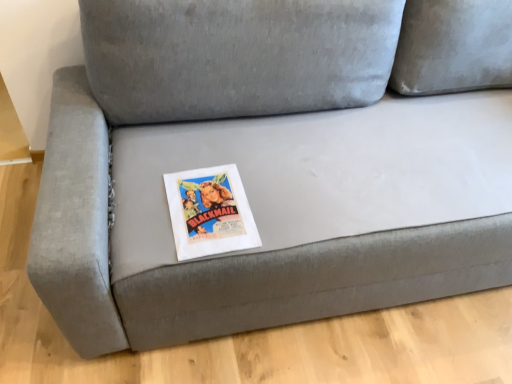
Find the location of a particular element. The height and width of the screenshot is (384, 512). white paper book at center is located at coordinates (210, 212).

What is the approximate width of white paper book at center?

It is 11.91 inches.

What is the approximate height of white paper book at center?

It is 0.62 inches.

The width and height of the screenshot is (512, 384). What do you see at coordinates (210, 212) in the screenshot?
I see `white paper book at center` at bounding box center [210, 212].

The height and width of the screenshot is (384, 512). I want to click on white paper book at center, so click(x=210, y=212).